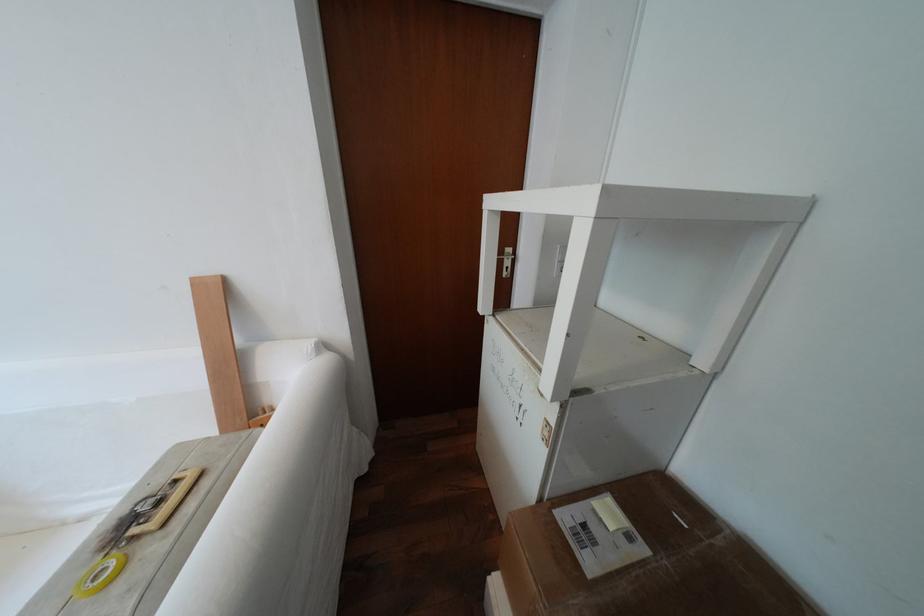
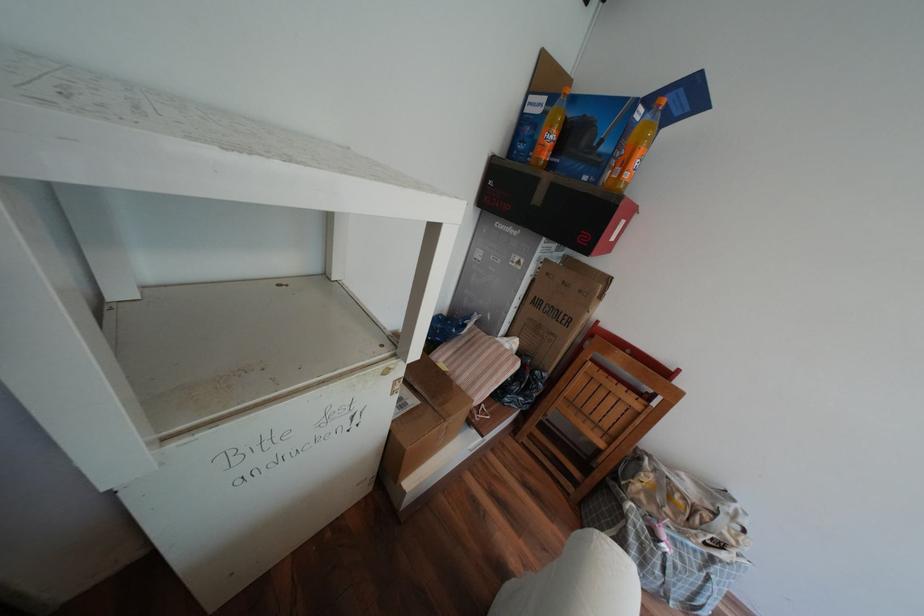
Locate, in the second image, the point that corresponds to (x=600, y=562) in the first image.

(422, 400)